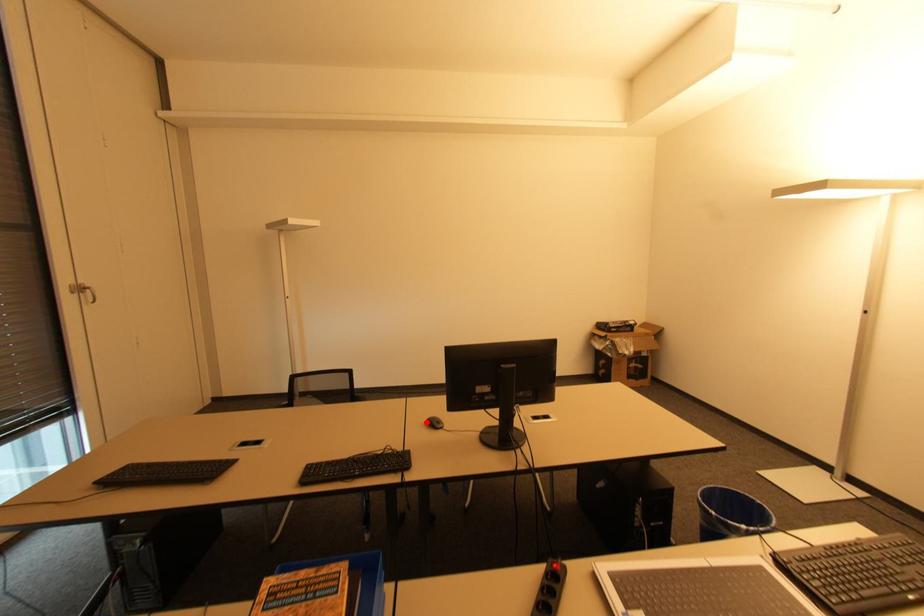
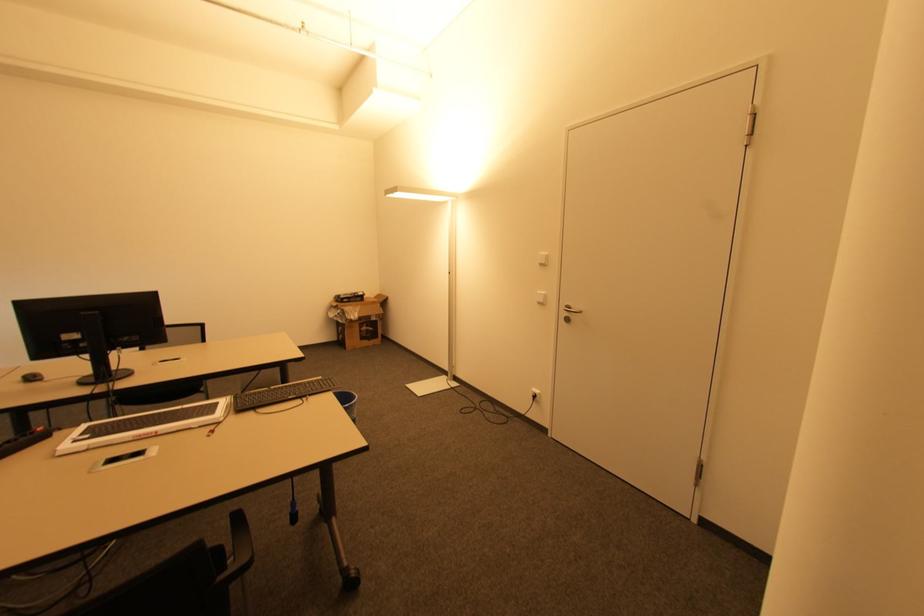
Locate, in the second image, the point that corresponds to the highlighted location in the first image.

(21, 379)